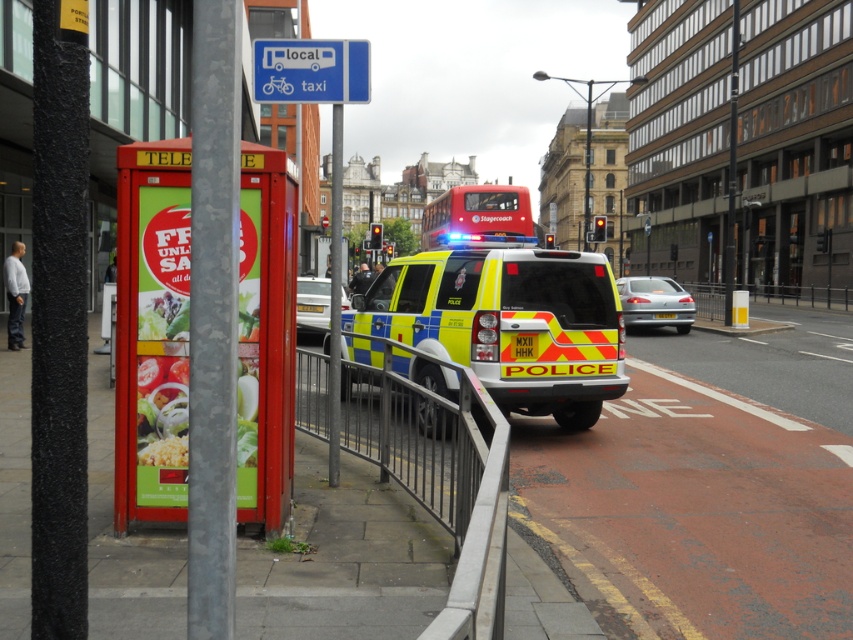
Question: Which object is farther from the camera taking this photo?

Choices:
 (A) metallic gray pole at center-left
 (B) red plastic telephone booth at left
 (C) silver metallic sedan at center
 (D) white glossy sedan at center

Answer: (C)

Question: Does red plastic telephone booth at left appear under metallic gray pole at center-left?

Choices:
 (A) no
 (B) yes

Answer: (B)

Question: Does red plastic telephone booth at left have a larger size compared to silver metallic sedan at center?

Choices:
 (A) yes
 (B) no

Answer: (A)

Question: Which of the following is the farthest from the observer?

Choices:
 (A) (471, 256)
 (B) (306, 301)

Answer: (B)

Question: Is blue plastic sign at upper center above metallic pole at center?

Choices:
 (A) yes
 (B) no

Answer: (B)

Question: Which object is farther from the camera taking this photo?

Choices:
 (A) white glossy sedan at center
 (B) metallic gray railing at center

Answer: (A)